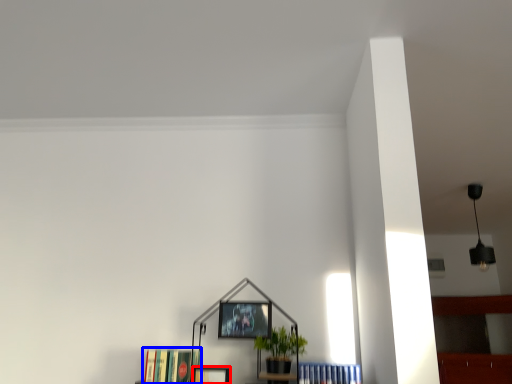
Question: Which object is closer to the camera taking this photo, picture frame (highlighted by a red box) or book (highlighted by a blue box)?

Choices:
 (A) picture frame
 (B) book

Answer: (B)